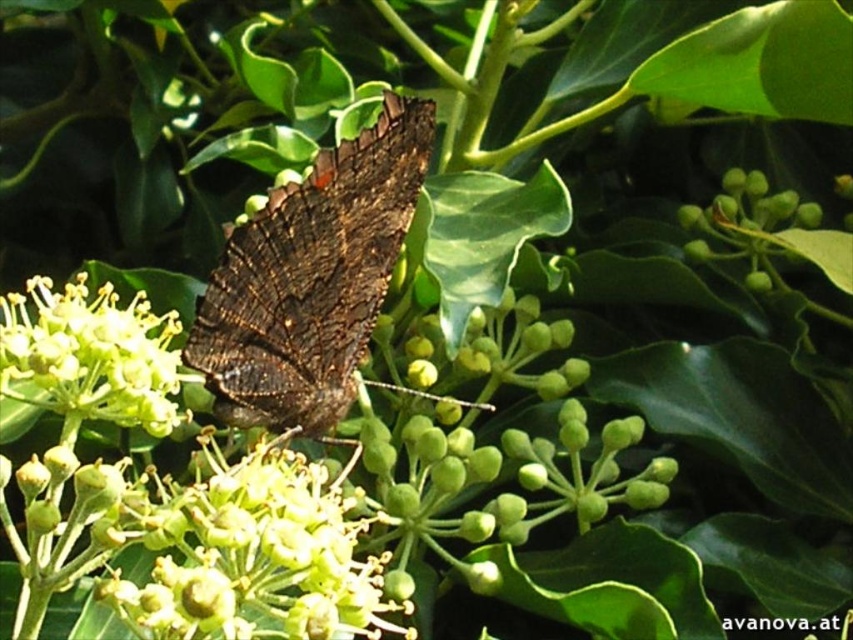
You are standing at the point marked as point (x=379, y=589) in the image. The butterfly is perched on a cluster of small greenish yellow flowers. Can you see the butterfly from your current position?

Yes, because the point (x=379, y=589) is 4.36 feet away from the viewer, so the viewer can see the butterfly at that position.